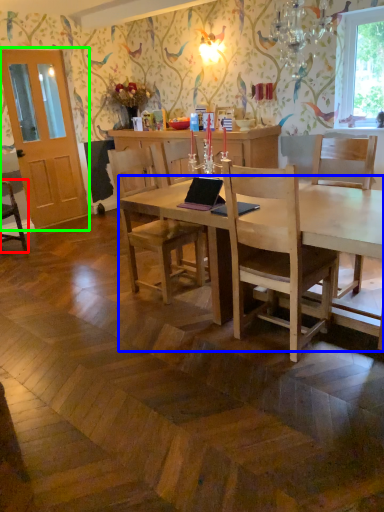
Question: Considering the real-world distances, which object is closest to chair (highlighted by a red box)? desk (highlighted by a blue box) or glass door (highlighted by a green box).

Choices:
 (A) desk
 (B) glass door

Answer: (B)